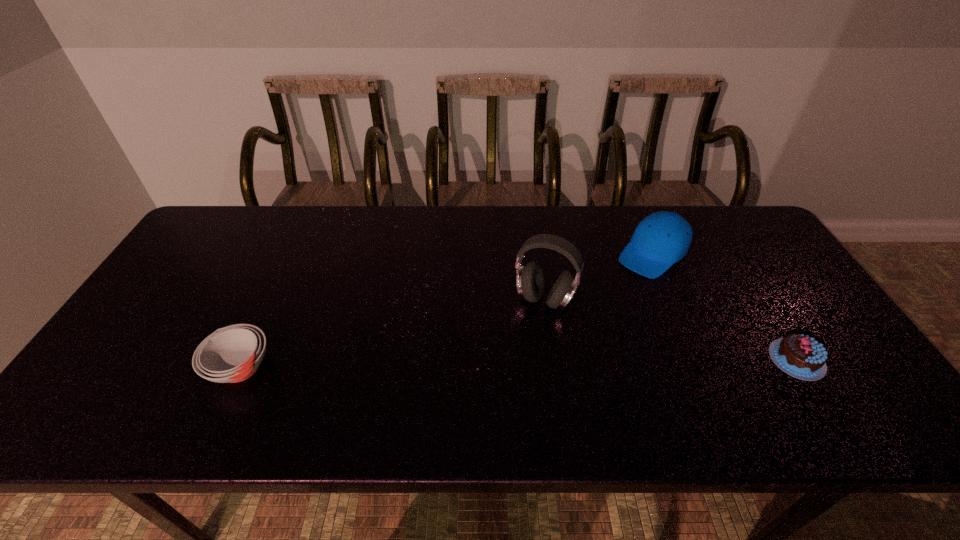
You are a GUI agent. You are given a task and a screenshot of the screen. Output one action in this format:
    pyautogui.click(x=<x>, y=<y>)
    Task: Click on the free location at the near edge
    Image resolution: width=960 pixels, height=540 pixels.
    Given the screenshot: What is the action you would take?
    pyautogui.click(x=687, y=373)

Find the location of a particular element. vacant area at the right edge of the desktop is located at coordinates (774, 273).

Find the location of `free spot at the near left corner of the desktop`. free spot at the near left corner of the desktop is located at coordinates (121, 382).

At what (x,y) coordinates should I click in order to perform the action: click on blank space at the far right corner of the desktop. Please return your answer as a coordinate pair (x, y). The width and height of the screenshot is (960, 540). Looking at the image, I should click on (753, 239).

At what (x,y) coordinates should I click in order to perform the action: click on vacant space that's between the chocolate cake and the tallest object. Please return your answer as a coordinate pair (x, y). This screenshot has width=960, height=540. Looking at the image, I should click on (670, 330).

Where is `free spot between the second object from right to left and the chocolate cake`? The image size is (960, 540). free spot between the second object from right to left and the chocolate cake is located at coordinates (724, 307).

This screenshot has width=960, height=540. I want to click on free area in between the farthest object and the second farthest object, so click(x=598, y=276).

Identify the location of vacant point located between the leftmost object and the chocolate cake. The width and height of the screenshot is (960, 540). (518, 364).

Find the location of a particular element. vacant area between the second object from right to left and the tallest object is located at coordinates (598, 276).

This screenshot has width=960, height=540. I want to click on empty space between the rightmost object and the leftmost object, so click(518, 364).